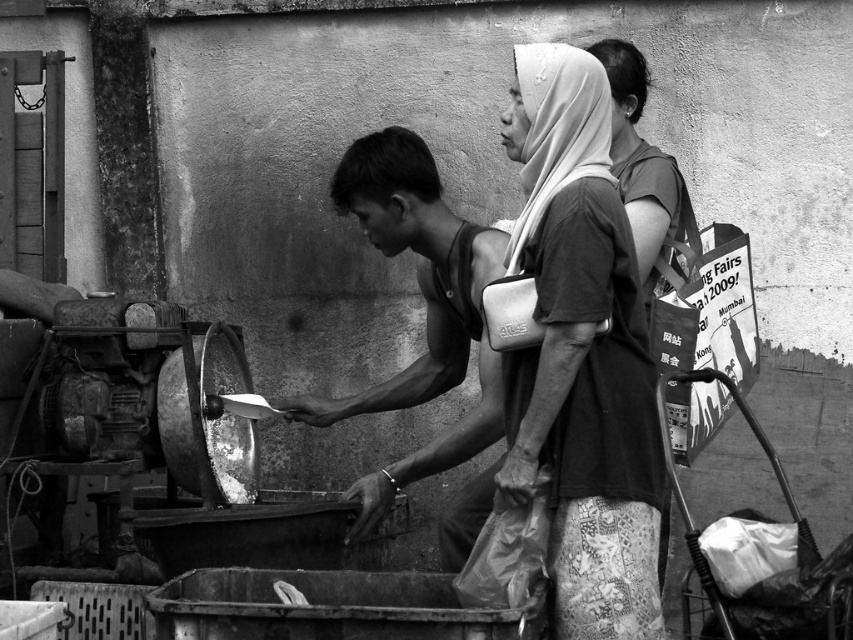
Question: Estimate the real-world distances between objects in this image. Which object is closer to the matte black headscarf at upper right?

Choices:
 (A) matte black purse at center
 (B) smooth skin man at center

Answer: (A)

Question: Does matte black purse at center appear on the right side of smooth skin man at center?

Choices:
 (A) yes
 (B) no

Answer: (A)

Question: Estimate the real-world distances between objects in this image. Which object is farther from the matte black purse at center?

Choices:
 (A) smooth skin man at center
 (B) matte black headscarf at upper right

Answer: (A)

Question: Considering the relative positions of matte black purse at center and smooth skin man at center in the image provided, where is matte black purse at center located with respect to smooth skin man at center?

Choices:
 (A) left
 (B) right

Answer: (B)

Question: Which point is closer to the camera?

Choices:
 (A) smooth skin man at center
 (B) matte black purse at center
 (C) matte black headscarf at upper right

Answer: (C)

Question: Does matte black purse at center come behind matte black headscarf at upper right?

Choices:
 (A) yes
 (B) no

Answer: (A)